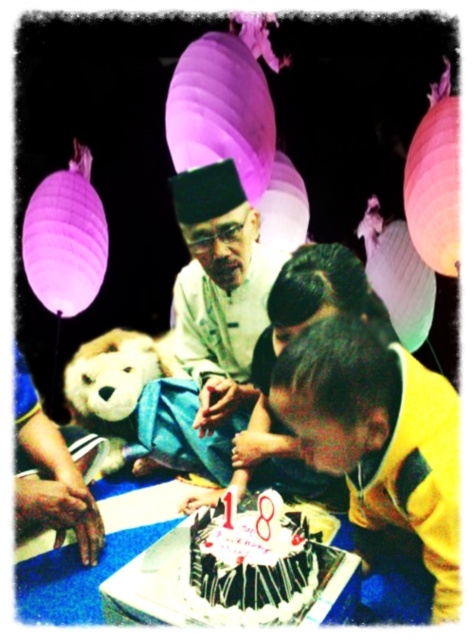
You are organizing a birthday party and need to place a 100 cm long banner between the yellow fabric shirt at lower right and the white silk shirt at center. Can the banner fit between them?

The distance between the yellow fabric shirt at lower right and the white silk shirt at center is 78.94 centimeters. Since the banner is 100 cm long, it cannot fit between them as it is longer than the available space.

You are standing at point (191, 218) and want to walk to the cake in the foreground. Is the point (359, 548) on your path?

Yes, the point (359, 548) is on your path to the cake because it is in front of point (191, 218), which is your starting position.

Consider the image. You are at the center of the scene and want to move to the yellow fabric shirt at lower right. Which direction should you move in?

To reach the yellow fabric shirt at lower right, you should move towards the lower right direction since it is located at point (380,436).